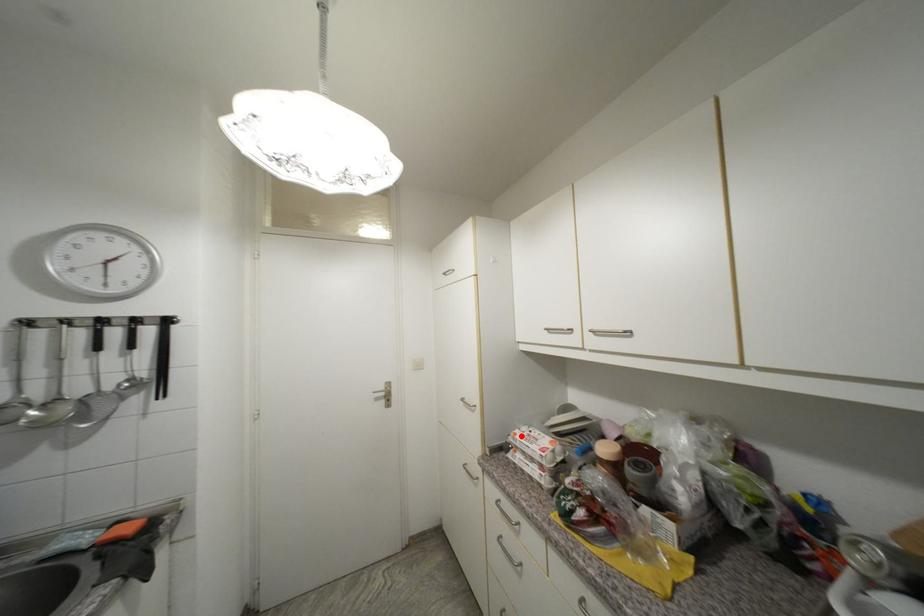
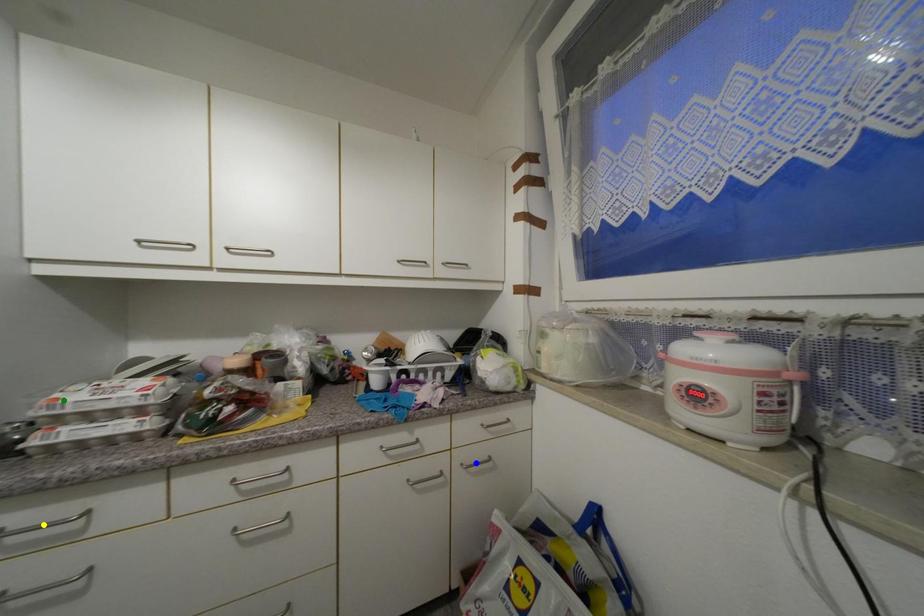
Question: I am providing you with two images of the same scene from different viewpoints. A red point is marked on the first image. You are given multiple points on the second image. Which mark in image 2 goes with the point in image 1?

Choices:
 (A) green point
 (B) blue point
 (C) yellow point

Answer: (A)